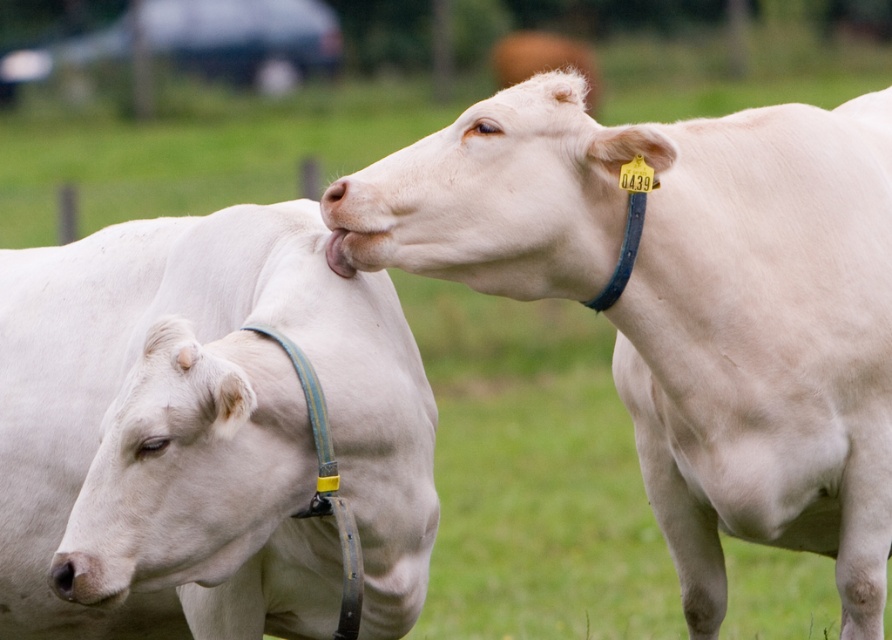
Is white smooth cow at upper right bigger than white leather collar at left?

Yes, white smooth cow at upper right is bigger than white leather collar at left.

Between point (786, 218) and point (271, 516), which one is positioned behind?

Point (786, 218)

Find the location of `white smooth cow at upper right`. white smooth cow at upper right is located at coordinates (687, 301).